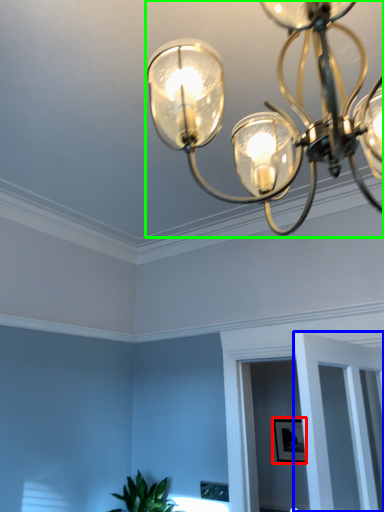
Question: Estimate the real-world distances between objects in this image. Which object is farther from picture frame (highlighted by a red box), glass door (highlighted by a blue box) or lamp (highlighted by a green box)?

Choices:
 (A) glass door
 (B) lamp

Answer: (B)